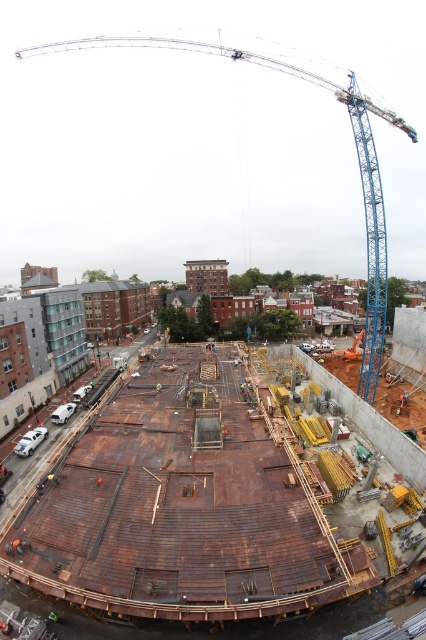
Question: Does rusty wood construction site at center have a lesser width compared to blue metallic crane at upper center?

Choices:
 (A) yes
 (B) no

Answer: (A)

Question: Among these points, which one is nearest to the camera?

Choices:
 (A) (371, 380)
 (B) (49, 464)

Answer: (B)

Question: Does rusty wood construction site at center lie in front of blue metallic crane at upper center?

Choices:
 (A) yes
 (B) no

Answer: (A)

Question: Does rusty wood construction site at center appear under blue metallic crane at upper center?

Choices:
 (A) yes
 (B) no

Answer: (A)

Question: Which object appears farthest from the camera in this image?

Choices:
 (A) rusty wood construction site at center
 (B) blue metallic crane at upper center

Answer: (B)